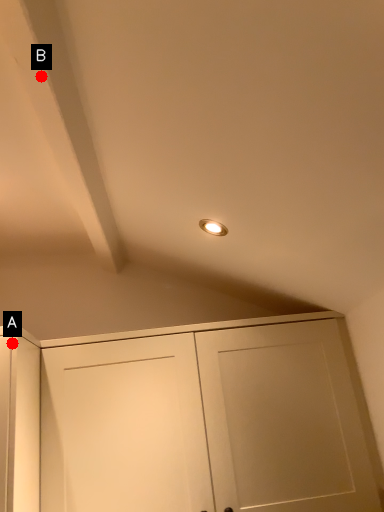
Question: Two points are circled on the image, labeled by A and B beside each circle. Which point is closer to the camera?

Choices:
 (A) A is closer
 (B) B is closer

Answer: (B)